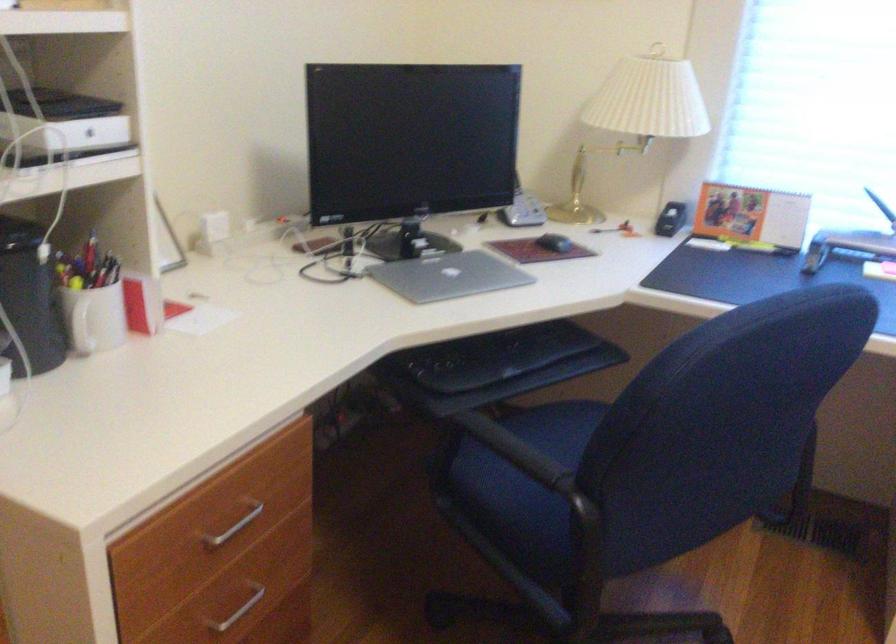
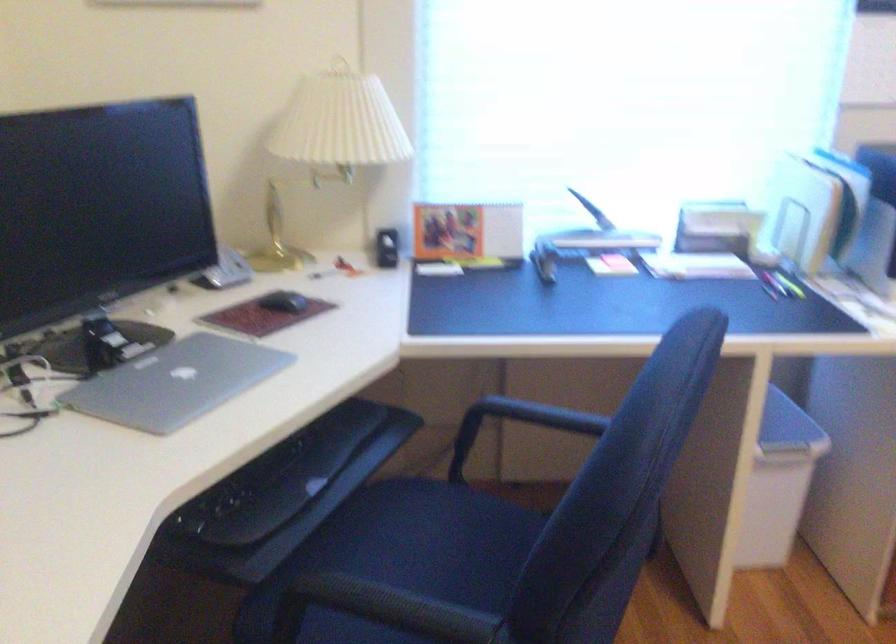
Question: The first image is from the beginning of the video and the second image is from the end. How did the camera likely rotate when shooting the video?

Choices:
 (A) Left
 (B) Right
 (C) Up
 (D) Down

Answer: (B)